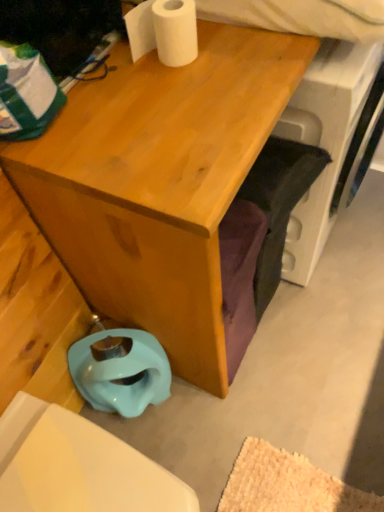
Locate an element on the screen. vacant space in front of white matte toilet paper at upper center is located at coordinates (178, 111).